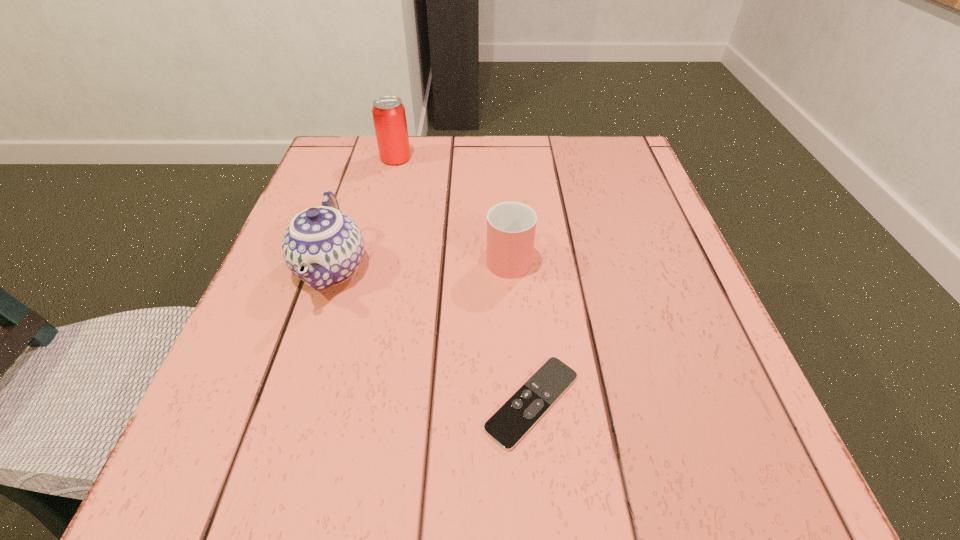
Identify the location of vacant region between the farthest object and the chinaware. (364, 213).

You are a GUI agent. You are given a task and a screenshot of the screen. Output one action in this format:
    pyautogui.click(x=<x>, y=<y>)
    Task: Click on the unoccupied area between the remote control and the third tallest object
    
    Given the screenshot: What is the action you would take?
    pyautogui.click(x=520, y=329)

At what (x,y) coordinates should I click in order to perform the action: click on free space between the nearest object and the can. Please return your answer as a coordinate pair (x, y). This screenshot has height=540, width=960. Looking at the image, I should click on (464, 280).

Image resolution: width=960 pixels, height=540 pixels. What are the coordinates of `object that stands as the closest to the remote control` in the screenshot? It's located at (511, 226).

Choose which object is the third nearest neighbor to the nearest object. Please provide its 2D coordinates. Your answer should be formatted as a tuple, i.e. [(x, y)], where the tuple contains the x and y coordinates of a point satisfying the conditions above.

[(389, 116)]

This screenshot has height=540, width=960. What are the coordinates of `vacant point that satisfies the following two spatial constraints: 1. from the spout of the chinaware; 2. on the right side of the nearest object` in the screenshot? It's located at (286, 402).

At what (x,y) coordinates should I click in order to perform the action: click on free space that satisfies the following two spatial constraints: 1. from the spout of the remote control; 2. on the left side of the chinaware. Please return your answer as a coordinate pair (x, y). Image resolution: width=960 pixels, height=540 pixels. Looking at the image, I should click on (286, 402).

The height and width of the screenshot is (540, 960). What are the coordinates of `vacant area that satisfies the following two spatial constraints: 1. from the spout of the nearest object; 2. on the left side of the chinaware` in the screenshot? It's located at (286, 402).